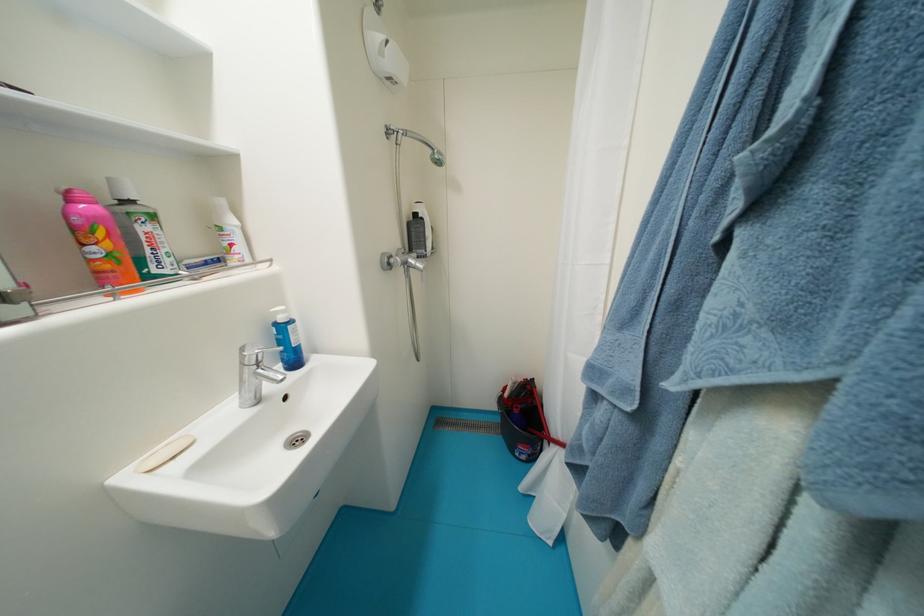
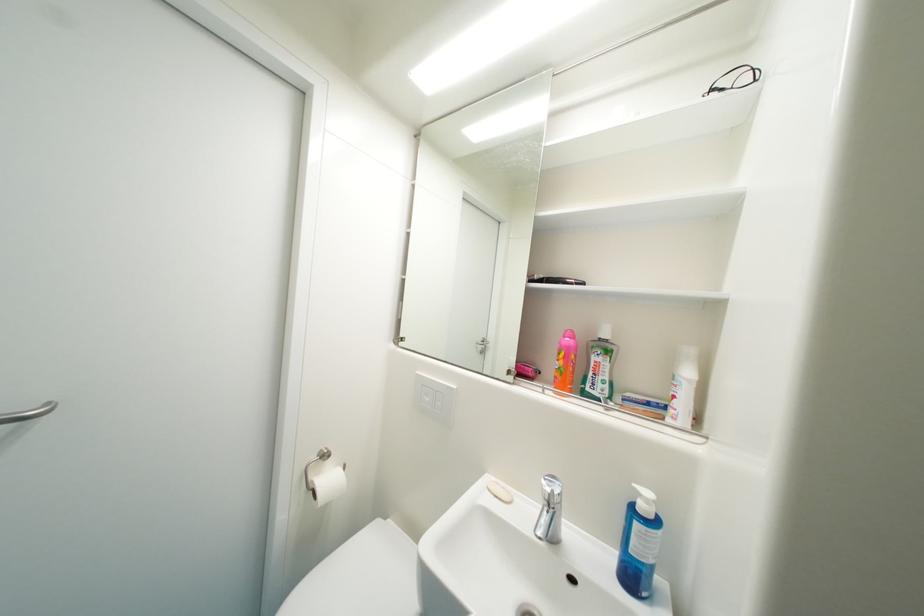
In the second image, find the point that corresponds to (289,314) in the first image.

(653, 503)